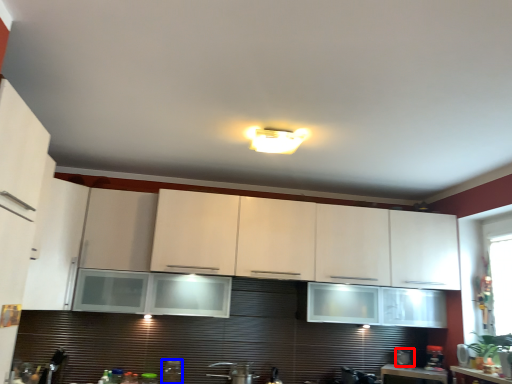
Question: Which object appears closest to the camera in this image, appliance (highlighted by a red box) or appliance (highlighted by a blue box)?

Choices:
 (A) appliance
 (B) appliance

Answer: (B)